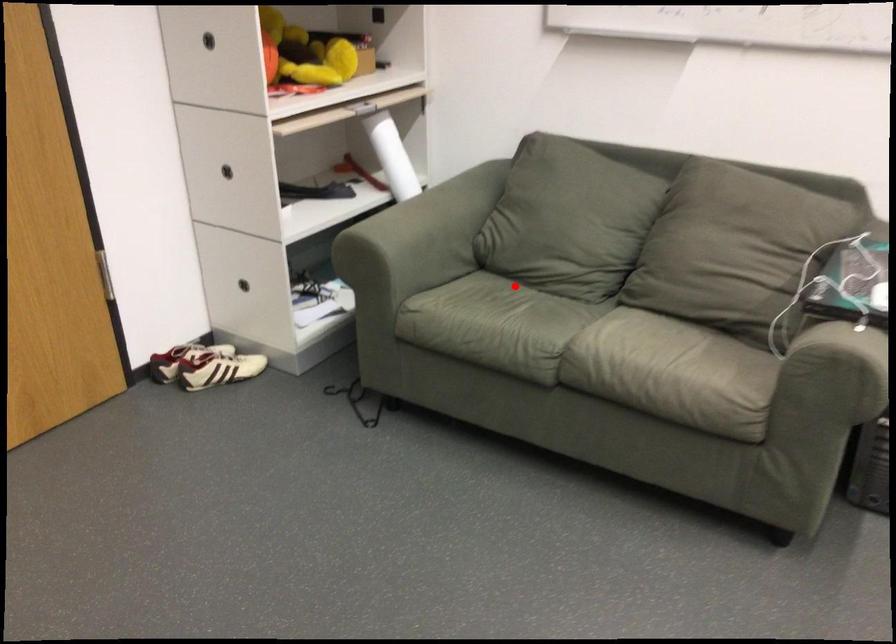
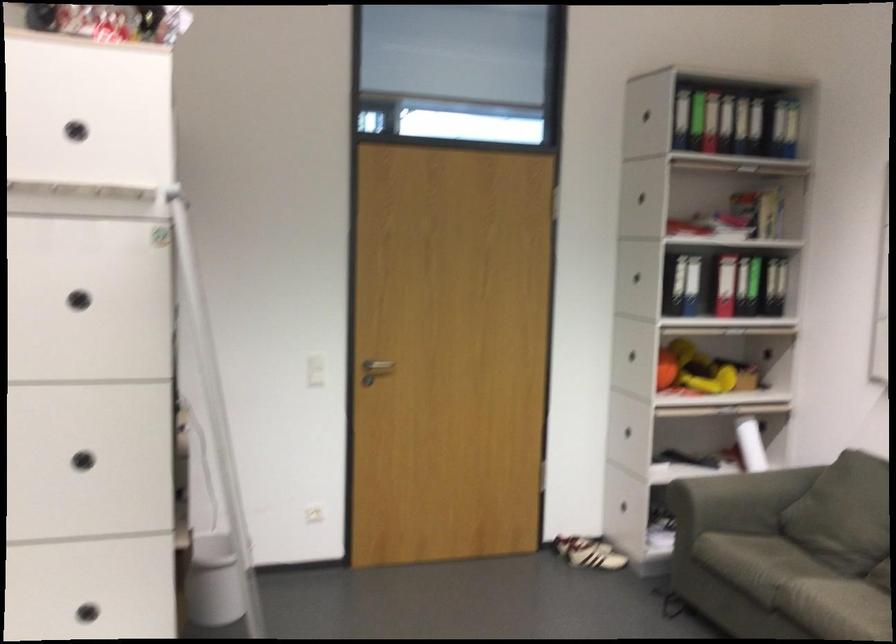
Question: A red point is marked in image1. In image2, is the corresponding 3D point closer to the camera or farther? Reply with the corresponding letter.

Choices:
 (A) The corresponding 3D point is closer.
 (B) The corresponding 3D point is farther.

Answer: (B)